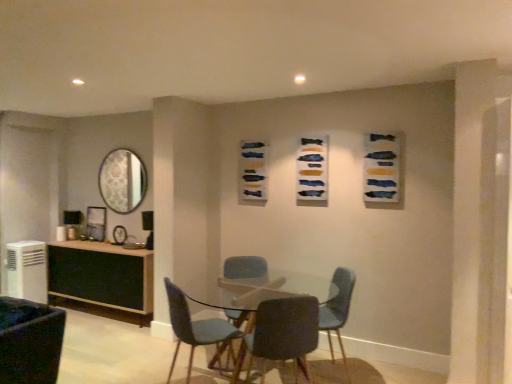
The height and width of the screenshot is (384, 512). I want to click on free location to the right of matte blue chair at center, the 1th chair viewed from the right, so click(x=371, y=369).